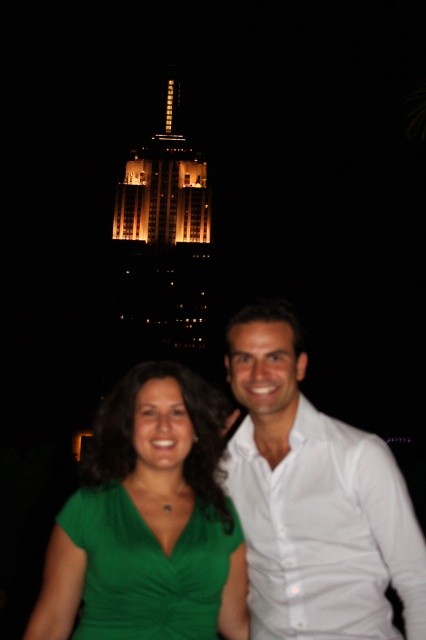
Question: Which of the following is the farthest from the observer?

Choices:
 (A) (402, 582)
 (B) (98, 570)

Answer: (A)

Question: Does white smooth shirt at center appear under illuminated glass tower at upper center?

Choices:
 (A) no
 (B) yes

Answer: (B)

Question: Which point is closer to the camera taking this photo?

Choices:
 (A) (120, 515)
 (B) (201, 337)
 (C) (224, 618)

Answer: (A)

Question: Which is farther from the illuminated glass tower at upper center?

Choices:
 (A) white smooth shirt at center
 (B) green fabric shirt at center

Answer: (A)

Question: From the image, what is the correct spatial relationship of green fabric shirt at center in relation to illuminated glass tower at upper center?

Choices:
 (A) above
 (B) below

Answer: (B)

Question: Does green fabric shirt at center come behind illuminated glass tower at upper center?

Choices:
 (A) yes
 (B) no

Answer: (B)